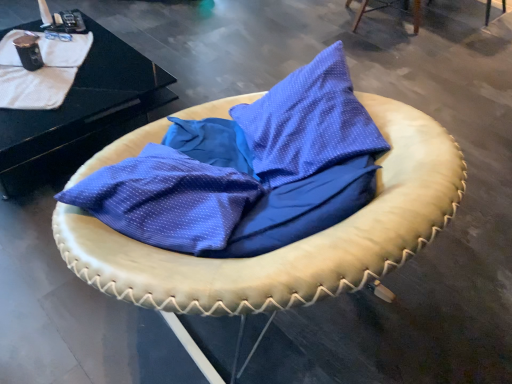
Where is `vacant space in white textured blanket at upper left (from a real-world perspective)`? This screenshot has width=512, height=384. vacant space in white textured blanket at upper left (from a real-world perspective) is located at coordinates (33, 86).